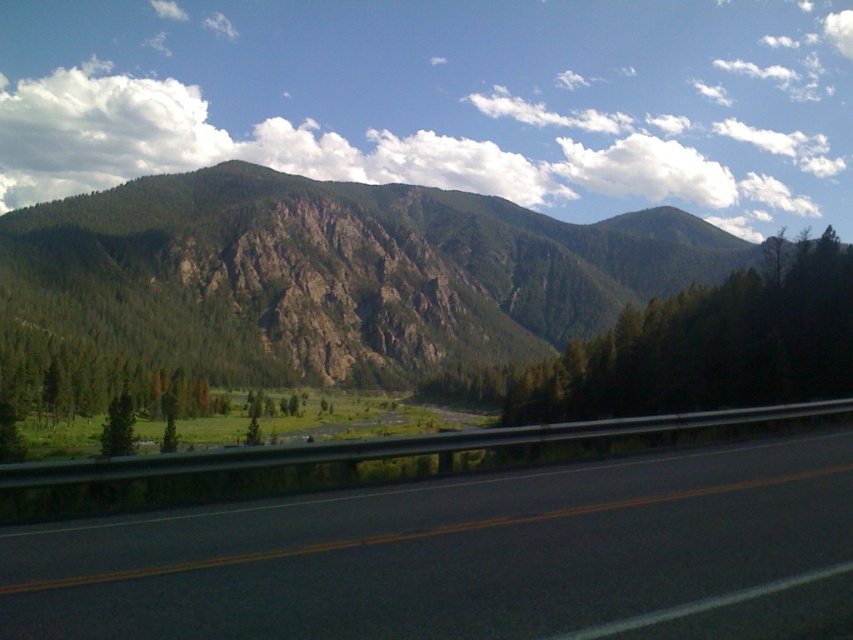
Image resolution: width=853 pixels, height=640 pixels. Find the location of `black asphalt highway at center`. black asphalt highway at center is located at coordinates (444, 552).

Does black asphalt highway at center have a lesser width compared to green rocky mountain at upper left?

Correct, black asphalt highway at center's width is less than green rocky mountain at upper left's.

The width and height of the screenshot is (853, 640). In order to click on black asphalt highway at center in this screenshot , I will do `click(444, 552)`.

Who is taller, green rocky mountain at upper left or green matte tree at center?

With more height is green matte tree at center.

Is the position of green rocky mountain at upper left more distant than that of green matte tree at center?

That is True.

Locate an element on the screen. Image resolution: width=853 pixels, height=640 pixels. green rocky mountain at upper left is located at coordinates (335, 273).

Is black asphalt highway at center behind green matte tree at center?

No, black asphalt highway at center is closer to the viewer.

At what (x,y) coordinates should I click in order to perform the action: click on black asphalt highway at center. Please return your answer as a coordinate pair (x, y). This screenshot has width=853, height=640. Looking at the image, I should click on (444, 552).

The height and width of the screenshot is (640, 853). I want to click on black asphalt highway at center, so 444,552.